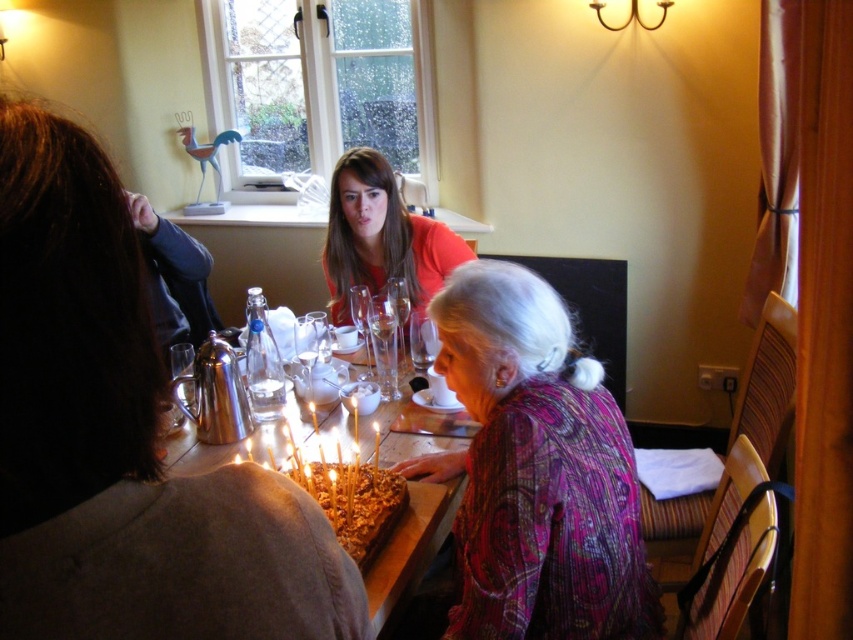
Measure the distance from candle-lit cake at center to clear glass wine glass at center.

candle-lit cake at center and clear glass wine glass at center are 48.36 centimeters apart from each other.

Between candle-lit cake at center and clear glass wine glass at center, which one has more height?

candle-lit cake at center is taller.

Where is `candle-lit cake at center`? Image resolution: width=853 pixels, height=640 pixels. candle-lit cake at center is located at coordinates [x=409, y=550].

The image size is (853, 640). What are the coordinates of `candle-lit cake at center` in the screenshot? It's located at (409, 550).

Is point (561, 410) positioned before point (393, 314)?

Yes, it is.

Which of these two, patterned fabric blouse at center or clear glass wine glass at center, stands taller?

Standing taller between the two is patterned fabric blouse at center.

Between point (634, 534) and point (397, 276), which one is positioned behind?

Point (397, 276)

I want to click on patterned fabric blouse at center, so click(537, 470).

Describe the element at coordinates (537, 470) in the screenshot. The height and width of the screenshot is (640, 853). I see `patterned fabric blouse at center` at that location.

Between patterned fabric blouse at center and crispy golden cake at center, which one appears on the right side from the viewer's perspective?

patterned fabric blouse at center

Is point (537, 378) positioned in front of point (366, 557)?

That is True.

Locate an element on the screen. Image resolution: width=853 pixels, height=640 pixels. patterned fabric blouse at center is located at coordinates (537, 470).